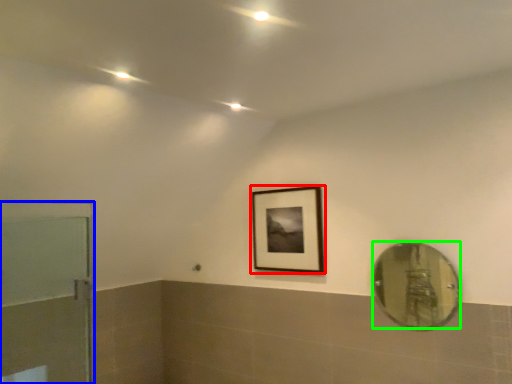
Question: Estimate the real-world distances between objects in this image. Which object is farther from picture frame (highlighted by a red box), door (highlighted by a blue box) or mirror (highlighted by a green box)?

Choices:
 (A) door
 (B) mirror

Answer: (B)